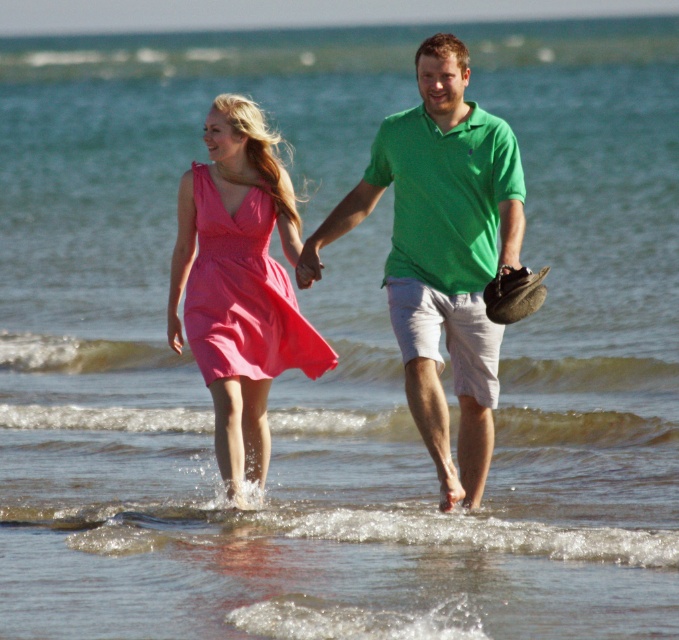
Question: Is green cotton polo shirt at center in front of pink satin dress at center?

Choices:
 (A) no
 (B) yes

Answer: (B)

Question: Is green cotton polo shirt at center smaller than pink satin dress at center?

Choices:
 (A) yes
 (B) no

Answer: (B)

Question: Based on their relative distances, which object is nearer to the pink satin dress at center?

Choices:
 (A) green cotton polo shirt at center
 (B) matte pink fabric dress at center

Answer: (B)

Question: Which of the following is the farthest from the observer?

Choices:
 (A) (221, 305)
 (B) (456, 42)
 (C) (234, 168)

Answer: (C)

Question: Estimate the real-world distances between objects in this image. Which object is closer to the matte pink fabric dress at center?

Choices:
 (A) pink satin dress at center
 (B) green cotton polo shirt at center

Answer: (A)

Question: Is pink satin dress at center bigger than matte pink fabric dress at center?

Choices:
 (A) no
 (B) yes

Answer: (B)